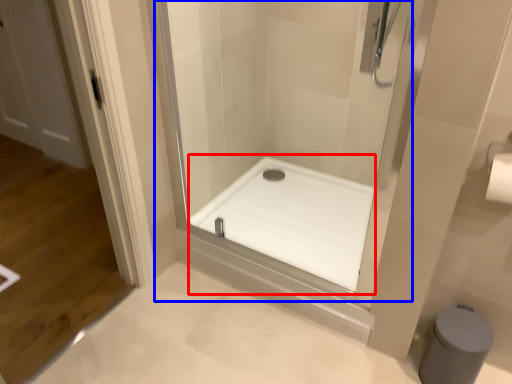
Question: Which of the following is the closest to the observer, bath (highlighted by a red box) or shower door (highlighted by a blue box)?

Choices:
 (A) bath
 (B) shower door

Answer: (B)